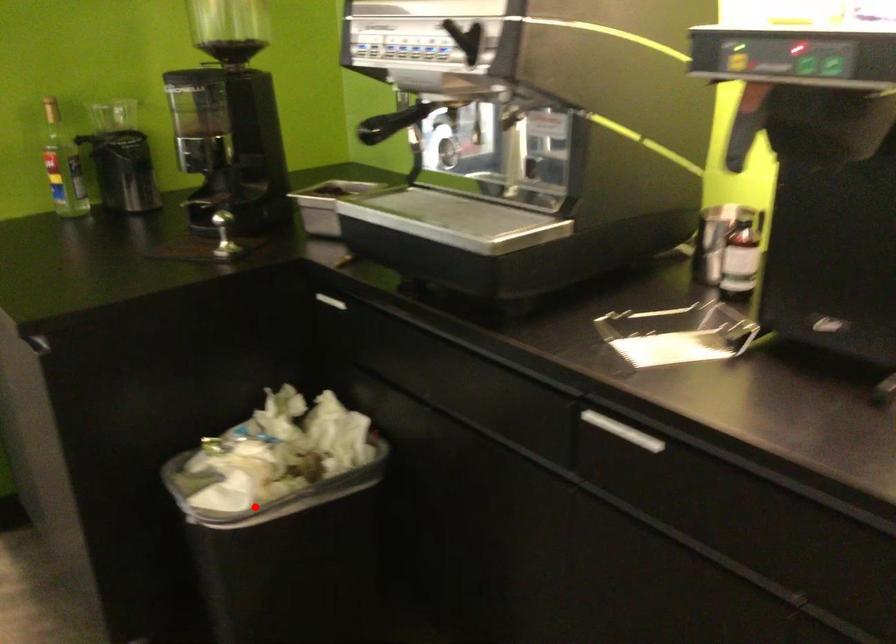
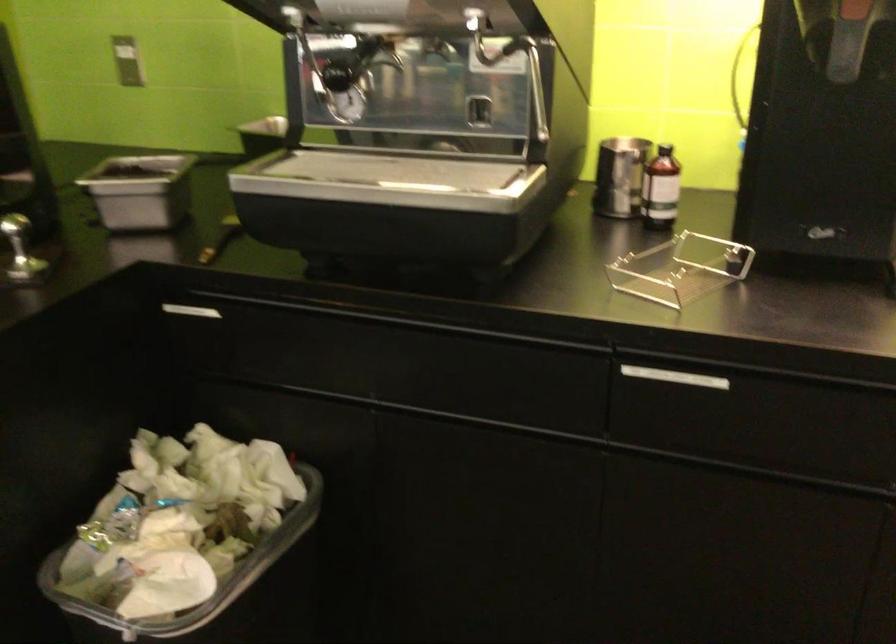
Locate, in the second image, the point that corresponds to the highlighted location in the first image.

(218, 592)